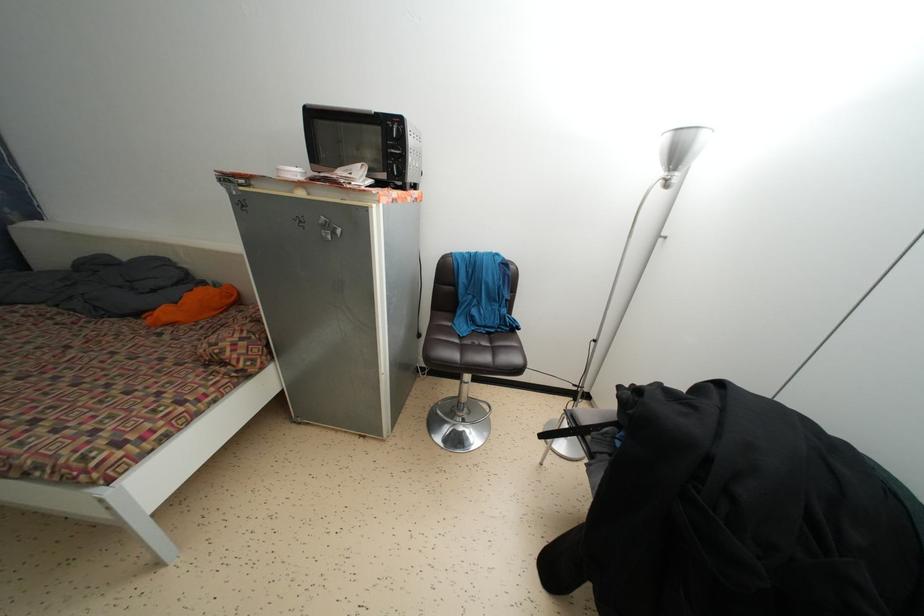
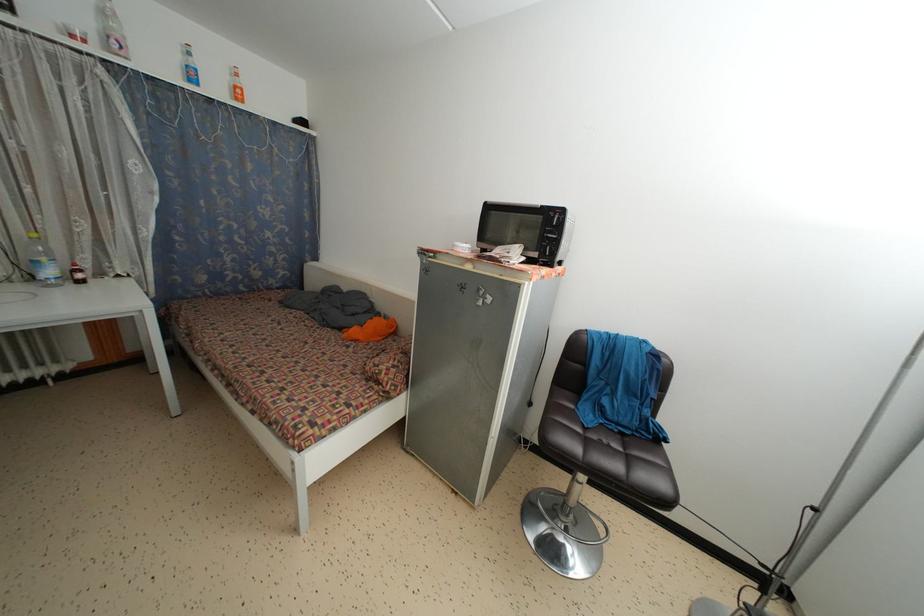
In a continuous first-person perspective shot, in which direction is the camera moving?

The cameraman moved toward left, backward.